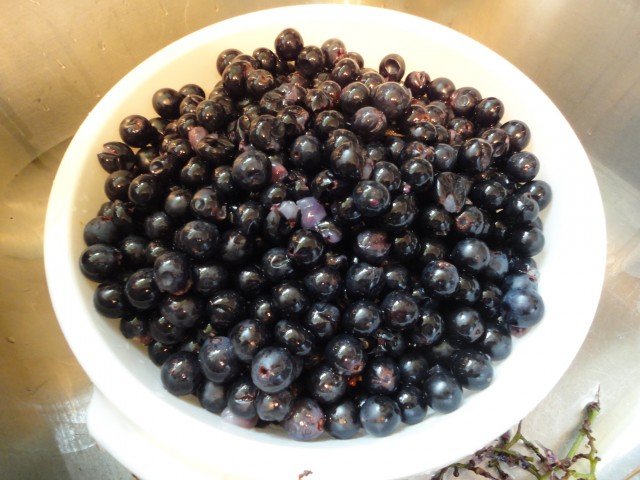
At what (x,y) coordinates should I click in order to perform the action: click on white bowl. Please return your answer as a coordinate pair (x, y). The width and height of the screenshot is (640, 480). Looking at the image, I should click on (113, 366).